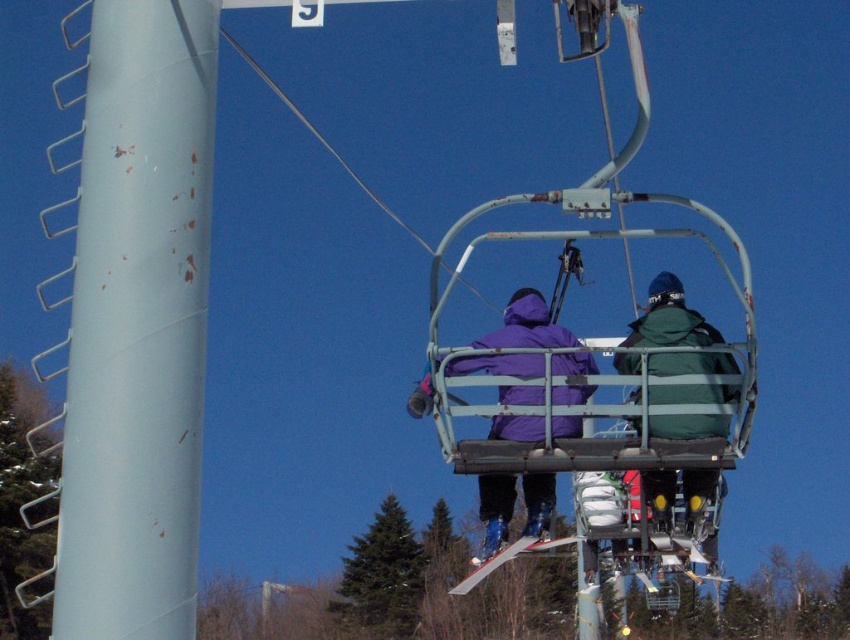
Is purple matte jacket at center positioned at the back of white plastic ski at center?

No.

This screenshot has width=850, height=640. What do you see at coordinates (669, 320) in the screenshot?
I see `purple matte jacket at center` at bounding box center [669, 320].

At what (x,y) coordinates should I click in order to perform the action: click on purple matte jacket at center. Please return your answer as a coordinate pair (x, y). Looking at the image, I should click on (669, 320).

Looking at this image, is green matte jacket at center to the left of white plastic ski at center from the viewer's perspective?

No, green matte jacket at center is not to the left of white plastic ski at center.

Measure the distance from green matte jacket at center to white plastic ski at center.

The distance of green matte jacket at center from white plastic ski at center is 5.10 meters.

Where is `green matte jacket at center`? This screenshot has width=850, height=640. green matte jacket at center is located at coordinates (669, 317).

Image resolution: width=850 pixels, height=640 pixels. Find the location of `green matte jacket at center`. green matte jacket at center is located at coordinates (669, 317).

Does light blue plastic pole at left appear on the left side of green matte jacket at center?

Indeed, light blue plastic pole at left is positioned on the left side of green matte jacket at center.

Does light blue plastic pole at left appear over green matte jacket at center?

Yes.

Find the location of a particular element. This screenshot has height=640, width=850. light blue plastic pole at left is located at coordinates (139, 324).